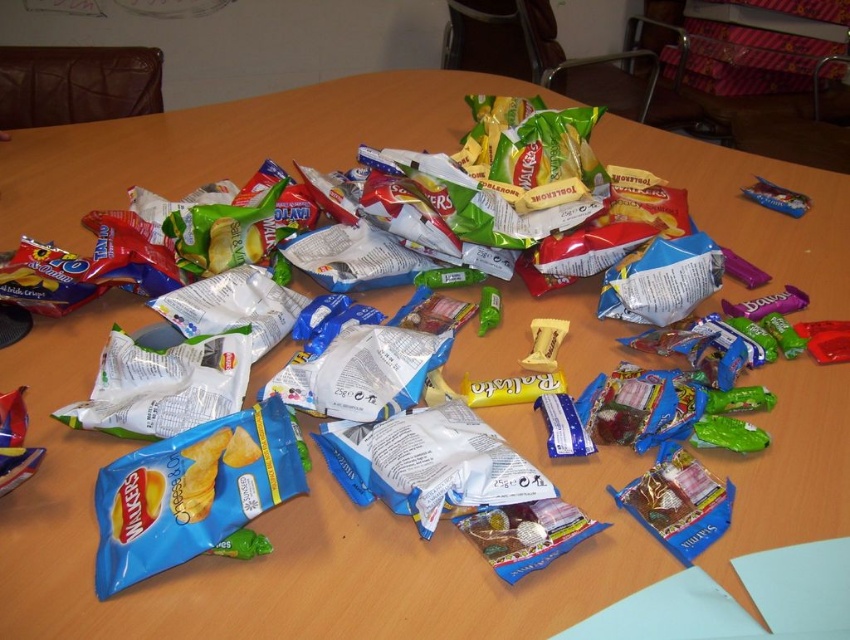
You are organizing snacks on a round wooden table for a party. You have a blue matte chip bag at lower left and a green rubber toy at center. Where should you place a new snack bowl to ensure it is between these two items?

Place the new snack bowl between the blue matte chip bag at lower left and the green rubber toy at center. Since the blue matte chip bag at lower left is below the green rubber toy at center, the bowl should be positioned above the blue bag and below the green toy to be between them.

You are organizing snacks on a round wooden table for a party. You have a blue matte chip bag at lower left and a green rubber toy at center. Which item takes up more horizontal space on the table?

The blue matte chip bag at lower left is wider than the green rubber toy at center, so it takes up more horizontal space on the table.